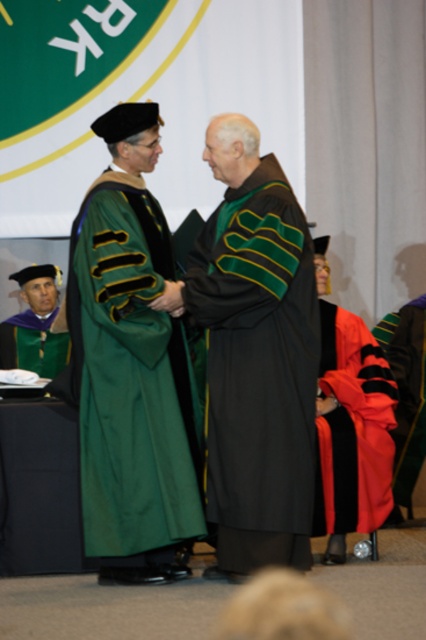
Question: Which point is closer to the camera?

Choices:
 (A) (x=74, y=317)
 (B) (x=409, y=355)

Answer: (A)

Question: Among these objects, which one is nearest to the camera?

Choices:
 (A) green matte graduation gown at lower left
 (B) red matte gown at lower right
 (C) red velvet gown at lower right
 (D) black matte gown at center

Answer: (D)

Question: Which point appears farthest from the camera in this image?

Choices:
 (A) (x=322, y=481)
 (B) (x=406, y=458)
 (C) (x=75, y=364)

Answer: (B)

Question: Is red matte gown at lower right further to camera compared to green matte graduation gown at lower left?

Choices:
 (A) yes
 (B) no

Answer: (B)

Question: Is black matte gown at center to the left of red velvet gown at lower right from the viewer's perspective?

Choices:
 (A) no
 (B) yes

Answer: (B)

Question: Does black matte gown at center have a greater width compared to red matte gown at lower right?

Choices:
 (A) yes
 (B) no

Answer: (A)